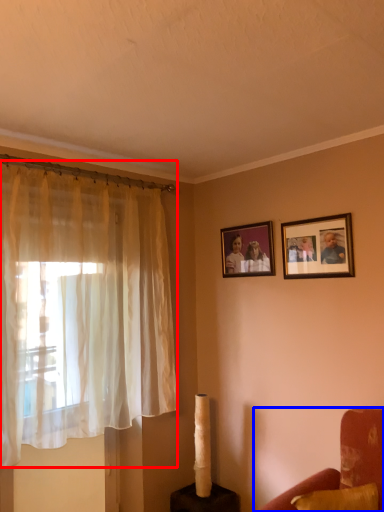
Question: Among these objects, which one is nearest to the camera, curtain (highlighted by a red box) or furniture (highlighted by a blue box)?

Choices:
 (A) curtain
 (B) furniture

Answer: (B)